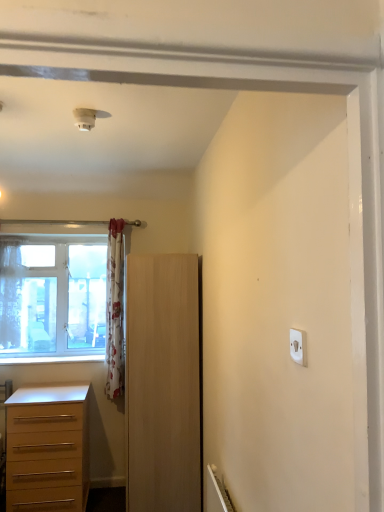
Question: Can you confirm if clear glass window at left is positioned to the right of white painted wood at lower left?

Choices:
 (A) yes
 (B) no

Answer: (B)

Question: From the image's perspective, is clear glass window at left below white painted wood at lower left?

Choices:
 (A) yes
 (B) no

Answer: (B)

Question: Is clear glass window at left thinner than white painted wood at lower left?

Choices:
 (A) yes
 (B) no

Answer: (A)

Question: From the image's perspective, does clear glass window at left appear higher than white painted wood at lower left?

Choices:
 (A) no
 (B) yes

Answer: (B)

Question: From a real-world perspective, is clear glass window at left under white painted wood at lower left?

Choices:
 (A) yes
 (B) no

Answer: (B)

Question: Is clear glass window at left closer to the viewer compared to white painted wood at lower left?

Choices:
 (A) no
 (B) yes

Answer: (A)

Question: Does white plastic light switch at upper right have a larger size compared to light wood cupboard at center?

Choices:
 (A) yes
 (B) no

Answer: (B)

Question: Is white plastic light switch at upper right outside of light wood cupboard at center?

Choices:
 (A) yes
 (B) no

Answer: (A)

Question: From a real-world perspective, is white plastic light switch at upper right on light wood cupboard at center?

Choices:
 (A) no
 (B) yes

Answer: (B)

Question: Is white plastic light switch at upper right turned away from light wood cupboard at center?

Choices:
 (A) no
 (B) yes

Answer: (A)

Question: Considering the relative positions of white plastic light switch at upper right and light wood cupboard at center in the image provided, is white plastic light switch at upper right to the left of light wood cupboard at center from the viewer's perspective?

Choices:
 (A) yes
 (B) no

Answer: (B)

Question: Considering the relative sizes of white plastic light switch at upper right and light wood cupboard at center in the image provided, is white plastic light switch at upper right wider than light wood cupboard at center?

Choices:
 (A) no
 (B) yes

Answer: (A)

Question: Can you confirm if white plastic light switch at upper right is positioned to the right of clear glass window at left?

Choices:
 (A) yes
 (B) no

Answer: (A)